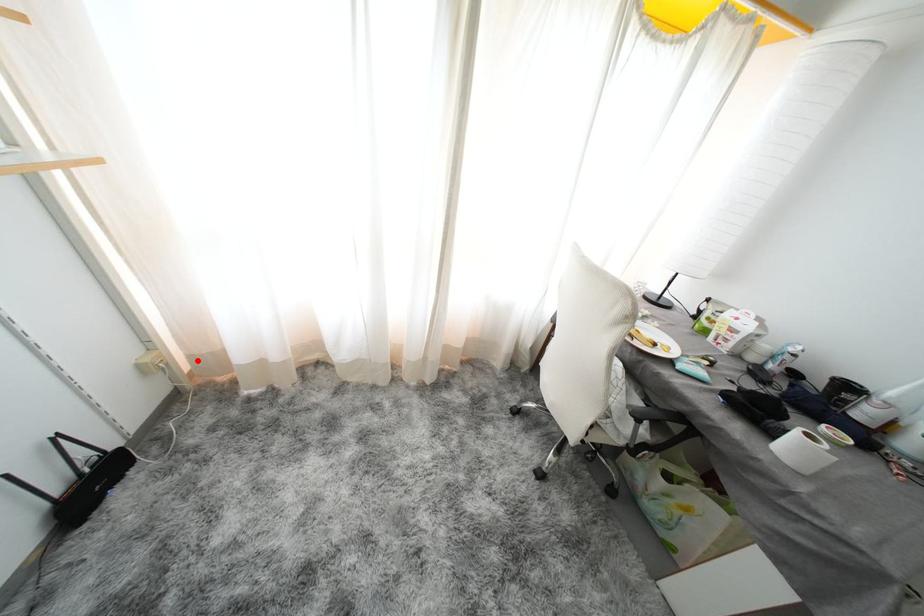
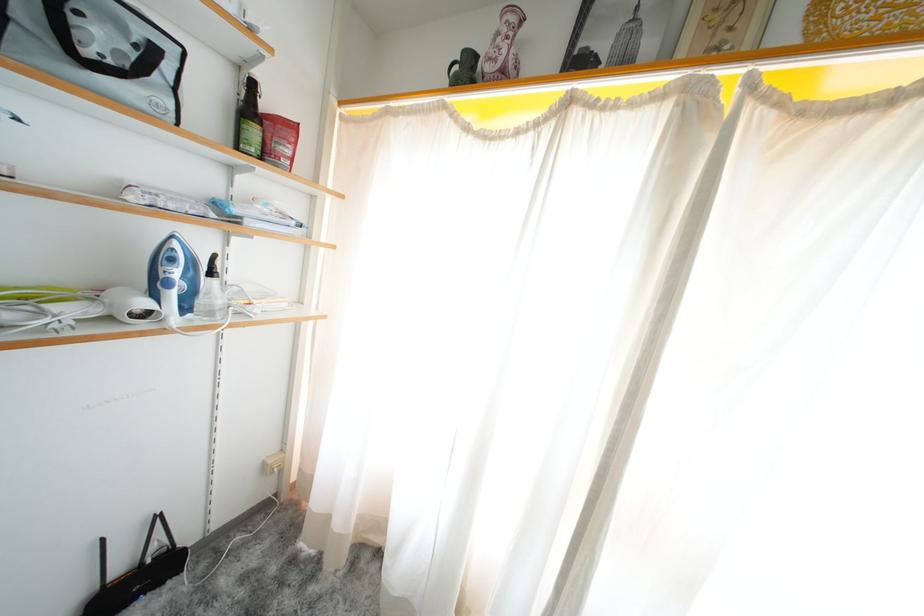
Question: I am providing you with two images of the same scene from different viewpoints. In image1, a red point is highlighted. Considering the same 3D point in image2, which of the following is correct?

Choices:
 (A) It is closer
 (B) It is farther

Answer: (B)